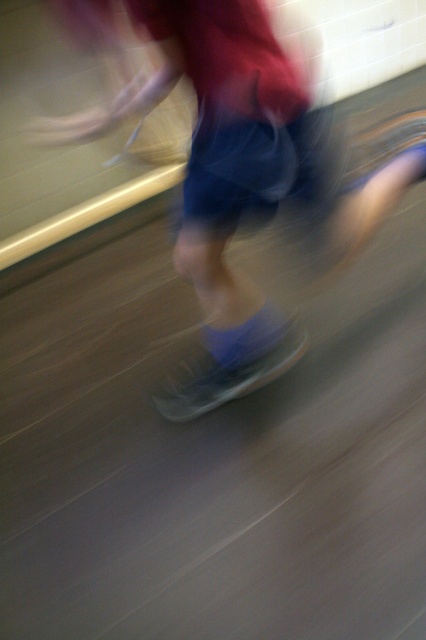
Is matte gray skateboard at center wider than translucent plastic skateboard at center?

Correct, the width of matte gray skateboard at center exceeds that of translucent plastic skateboard at center.

Which is in front, point (80, 33) or point (253, 378)?

Point (80, 33) is more forward.

At what (x,y) coordinates should I click in order to perform the action: click on matte gray skateboard at center. Please return your answer as a coordinate pair (x, y). Looking at the image, I should click on (239, 179).